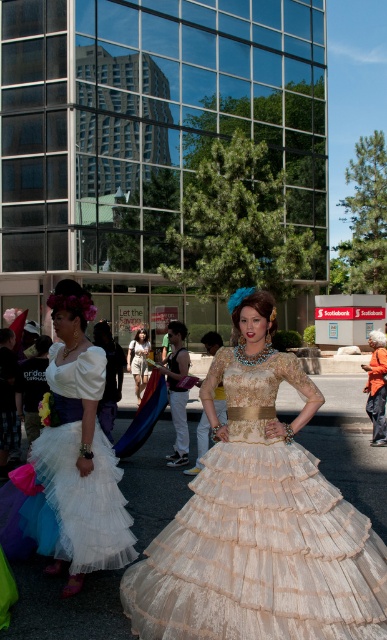
Question: Which point is farther to the camera?

Choices:
 (A) white tulle dress at center
 (B) ivory lace dress at center
 (C) orange fabric jacket at right

Answer: (C)

Question: Which object is positioned closest to the white tulle dress at center?

Choices:
 (A) orange fabric jacket at right
 (B) white cotton dress at center
 (C) ivory lace dress at center

Answer: (C)

Question: Which point is closer to the camera?

Choices:
 (A) orange fabric jacket at right
 (B) white tulle dress at center
 (C) ivory lace dress at center

Answer: (C)

Question: Is white tulle dress at center below orange fabric jacket at right?

Choices:
 (A) no
 (B) yes

Answer: (A)

Question: Is ivory lace dress at center wider than white tulle dress at center?

Choices:
 (A) yes
 (B) no

Answer: (A)

Question: Does white tulle dress at center have a larger size compared to white cotton dress at center?

Choices:
 (A) no
 (B) yes

Answer: (B)